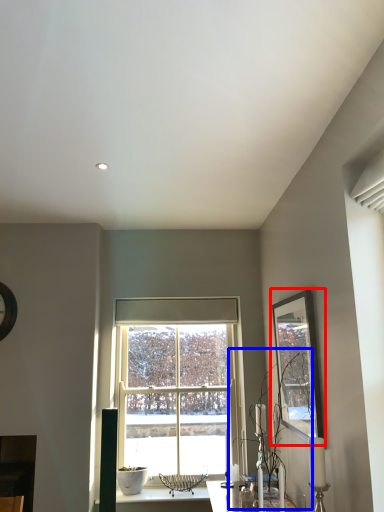
Question: Among these objects, which one is farthest to the camera, picture frame (highlighted by a red box) or plant (highlighted by a blue box)?

Choices:
 (A) picture frame
 (B) plant

Answer: (B)